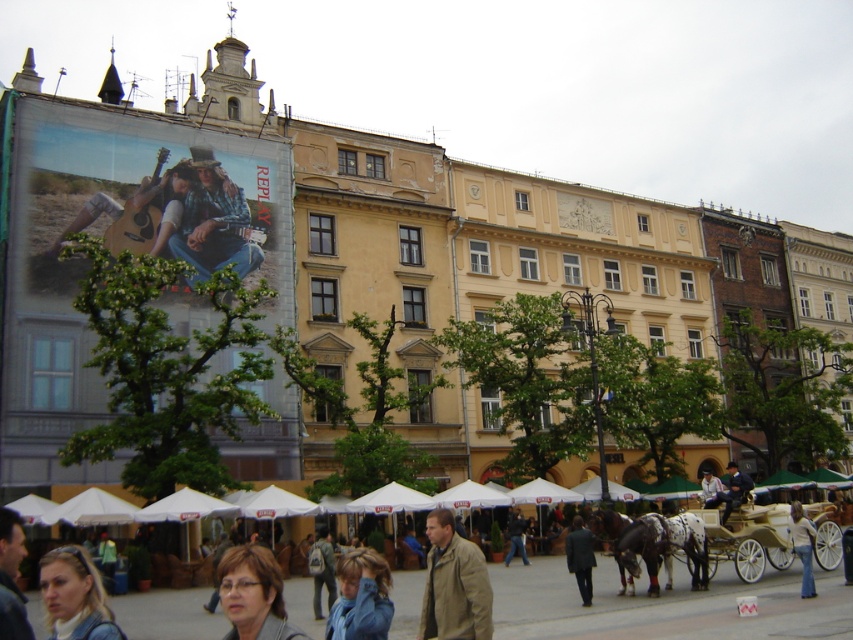
Describe the element at coordinates (454, 584) in the screenshot. I see `tan leather jacket at center` at that location.

Does tan leather jacket at center have a lesser width compared to dark blue jeans at center?

Incorrect, tan leather jacket at center's width is not less than dark blue jeans at center's.

Locate an element on the screen. The width and height of the screenshot is (853, 640). tan leather jacket at center is located at coordinates (454, 584).

Identify the location of tan leather jacket at center. (454, 584).

Which of these two, blonde hair at lower left or matte black jacket at lower left, stands taller?

blonde hair at lower left

Image resolution: width=853 pixels, height=640 pixels. Identify the location of blonde hair at lower left. (74, 596).

Does point (194, 163) come in front of point (323, 529)?

No, (194, 163) is further to viewer.

Is point (256, 262) closer to viewer compared to point (332, 563)?

That is False.

Locate an element on the screen. matte blue jeans at upper left is located at coordinates (213, 221).